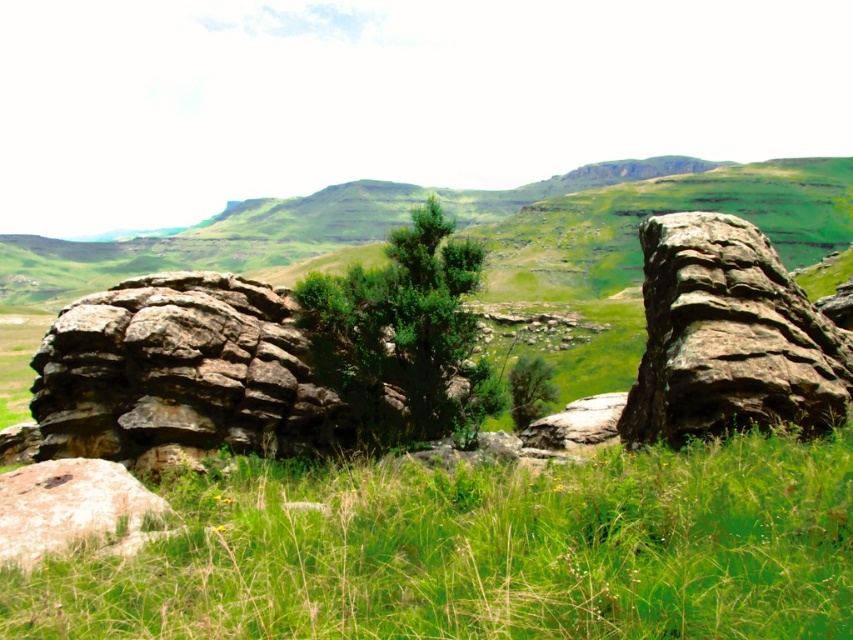
Question: Is green grassy at center smaller than green leafy tree at center?

Choices:
 (A) yes
 (B) no

Answer: (A)

Question: Which point is farther to the camera?

Choices:
 (A) (254, 477)
 (B) (675, 282)

Answer: (B)

Question: Can you confirm if green grassy at center is positioned below rusty stone boulder at right?

Choices:
 (A) no
 (B) yes

Answer: (B)

Question: Based on their relative distances, which object is farther from the rusty stone boulder at center-left?

Choices:
 (A) rusty stone boulder at right
 (B) green grassy at center
 (C) green leafy tree at center

Answer: (B)

Question: Which point is closer to the camera?

Choices:
 (A) rusty stone boulder at center-left
 (B) green grassy at center

Answer: (B)

Question: Can you confirm if green grassy at center is thinner than rusty stone boulder at center-left?

Choices:
 (A) yes
 (B) no

Answer: (B)